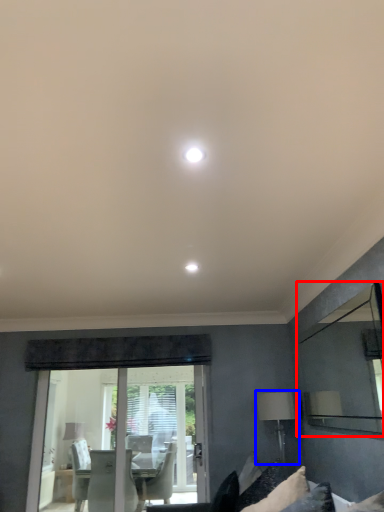
Question: Which object is closer to the camera taking this photo, mirror (highlighted by a red box) or table lamp (highlighted by a blue box)?

Choices:
 (A) mirror
 (B) table lamp

Answer: (A)